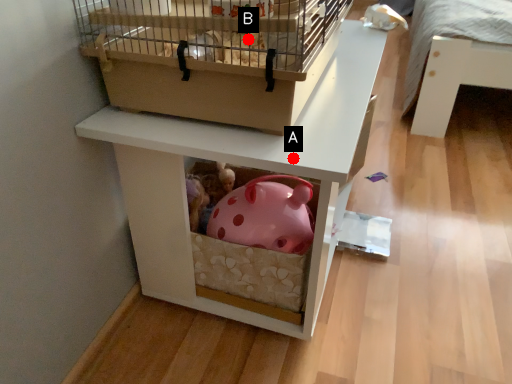
Question: Two points are circled on the image, labeled by A and B beside each circle. Which point appears closest to the camera in this image?

Choices:
 (A) A is closer
 (B) B is closer

Answer: (A)